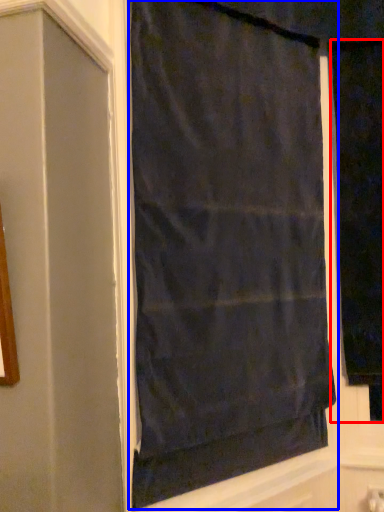
Question: Among these objects, which one is farthest to the camera, curtain (highlighted by a red box) or curtain (highlighted by a blue box)?

Choices:
 (A) curtain
 (B) curtain

Answer: (A)